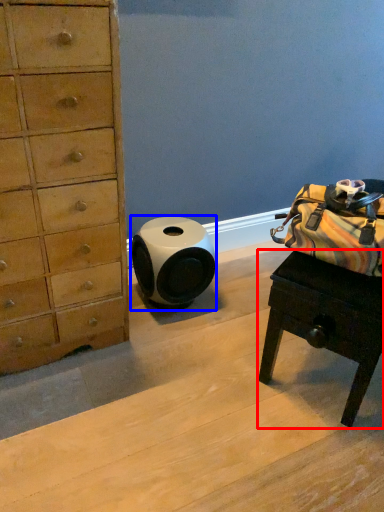
Question: Which object appears farthest to the camera in this image, desk (highlighted by a red box) or speaker (highlighted by a blue box)?

Choices:
 (A) desk
 (B) speaker

Answer: (B)